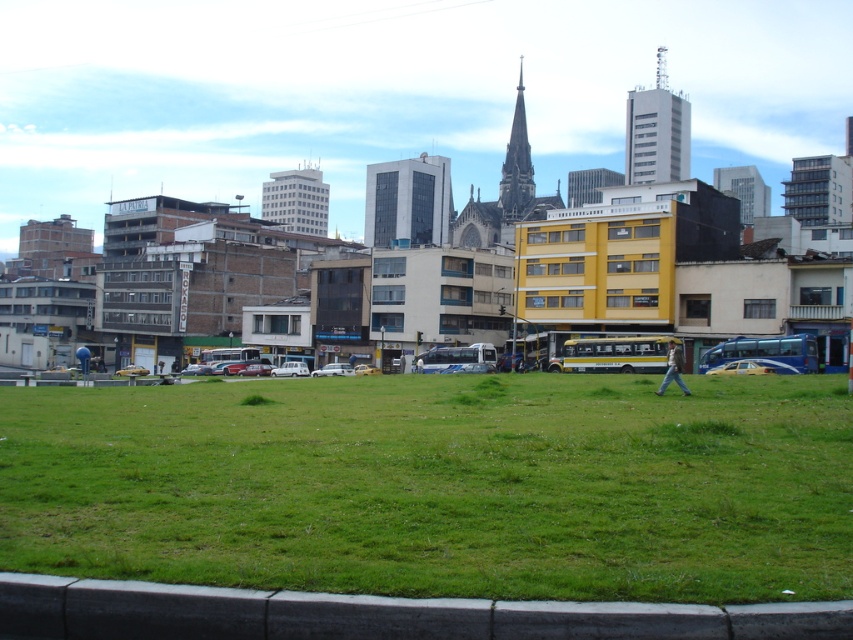
Question: Which object is farther from the camera taking this photo?

Choices:
 (A) blue metallic bus at right
 (B) green grassy field at center

Answer: (A)

Question: Does blue metallic bus at right appear under white matte car at center?

Choices:
 (A) no
 (B) yes

Answer: (A)

Question: Which point appears farthest from the camera in this image?

Choices:
 (A) click(x=334, y=365)
 (B) click(x=660, y=348)

Answer: (A)

Question: Can you confirm if blue metallic bus at right is wider than white matte car at center?

Choices:
 (A) no
 (B) yes

Answer: (B)

Question: Can you confirm if yellow metallic bus at center is positioned below white matte car at center?

Choices:
 (A) yes
 (B) no

Answer: (B)

Question: Estimate the real-world distances between objects in this image. Which object is farther from the yellow metallic bus at center?

Choices:
 (A) dark gray stone spire at center
 (B) matte black car at center
 (C) white matte car at center

Answer: (A)